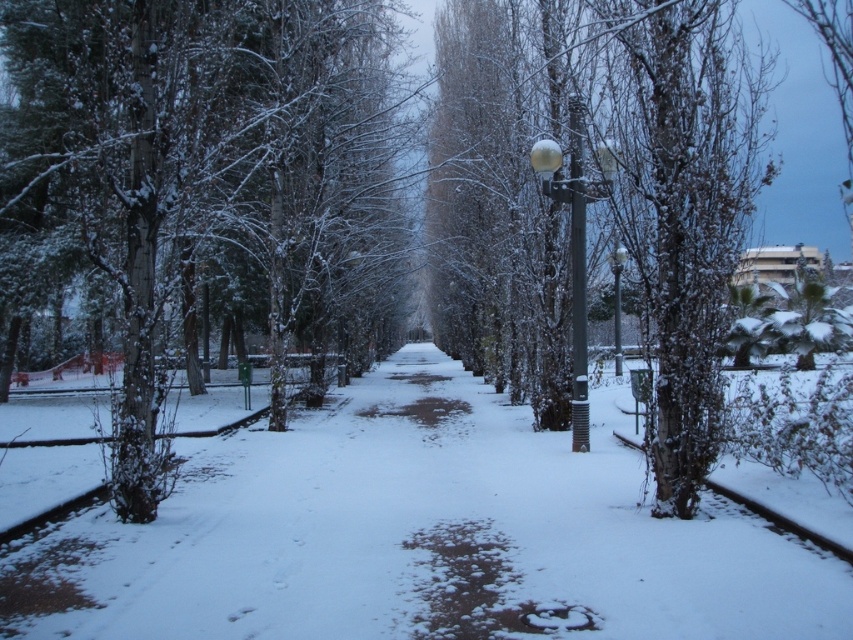
Can you confirm if snow-covered tree at left is bigger than sleek metallic lamp post at center?

Indeed, snow-covered tree at left has a larger size compared to sleek metallic lamp post at center.

Is snow-covered tree at left taller than sleek metallic lamp post at center?

Correct, snow-covered tree at left is much taller as sleek metallic lamp post at center.

Identify the location of snow-covered tree at left. (212, 173).

Who is shorter, snow-covered tree at left or snow-covered tree at center?

snow-covered tree at left is shorter.

Is snow-covered tree at left wider than snow-covered tree at center?

No, snow-covered tree at left is not wider than snow-covered tree at center.

Describe the element at coordinates (212, 173) in the screenshot. I see `snow-covered tree at left` at that location.

Image resolution: width=853 pixels, height=640 pixels. Identify the location of snow-covered tree at left. (212, 173).

Looking at this image, how far apart are snow-covered tree at left and glossy metal lamp post at center-right?

snow-covered tree at left and glossy metal lamp post at center-right are 10.88 meters apart from each other.

Who is shorter, snow-covered tree at left or glossy metal lamp post at center-right?

Standing shorter between the two is glossy metal lamp post at center-right.

What do you see at coordinates (212, 173) in the screenshot? I see `snow-covered tree at left` at bounding box center [212, 173].

Find the location of a particular element. The width and height of the screenshot is (853, 640). snow-covered tree at left is located at coordinates (212, 173).